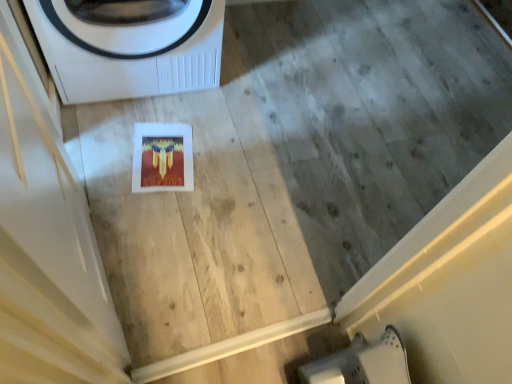
At what (x,y) coordinates should I click in order to perform the action: click on white plastic washing machine at upper left. Please return your answer as a coordinate pair (x, y). Image resolution: width=512 pixels, height=384 pixels. Looking at the image, I should click on (130, 52).

The width and height of the screenshot is (512, 384). What do you see at coordinates (130, 52) in the screenshot? I see `white plastic washing machine at upper left` at bounding box center [130, 52].

Where is `white plastic washing machine at upper left`? The image size is (512, 384). white plastic washing machine at upper left is located at coordinates (130, 52).